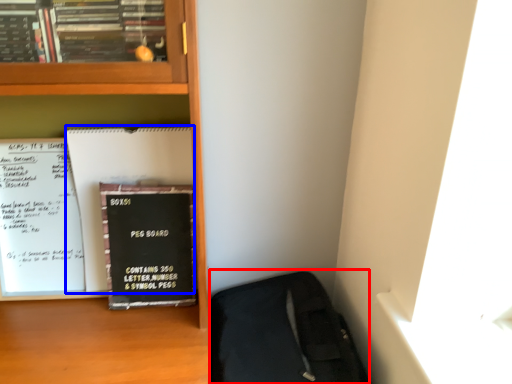
Question: Which point is further to the camera, sleeping bag (highlighted by a red box) or paperback book (highlighted by a blue box)?

Choices:
 (A) sleeping bag
 (B) paperback book

Answer: (B)